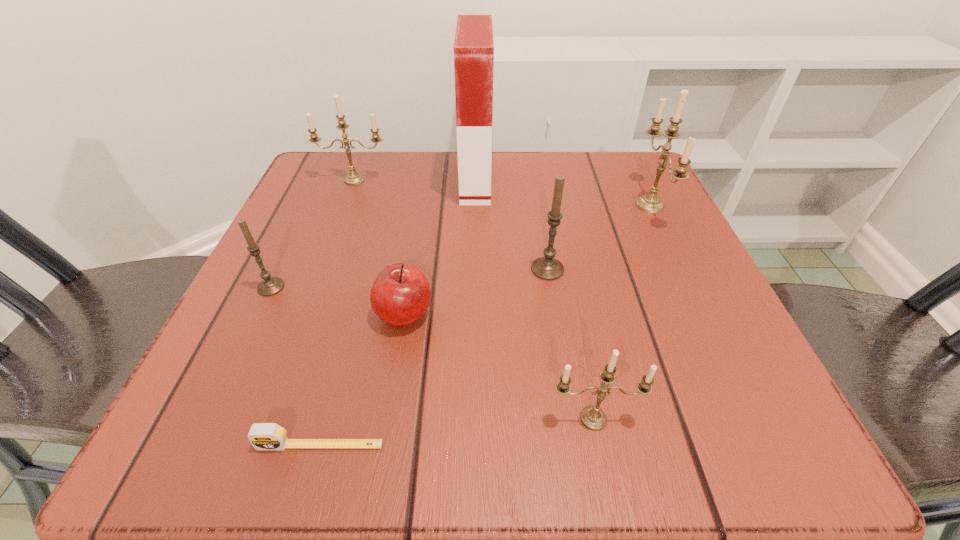
Where is `vacant space that's between the second smallest metallic candle and the nearest object`? This screenshot has width=960, height=540. vacant space that's between the second smallest metallic candle and the nearest object is located at coordinates (337, 312).

Image resolution: width=960 pixels, height=540 pixels. Identify the location of empty space that is in between the pink apple and the rightmost candle. (527, 260).

Image resolution: width=960 pixels, height=540 pixels. I want to click on vacant area between the rightmost metallic candle and the nearest candle, so click(x=621, y=312).

At what (x,y) coordinates should I click in order to perform the action: click on vacant space that is in between the pink apple and the second biggest metallic candle. Please return your answer as a coordinate pair (x, y). Looking at the image, I should click on (379, 247).

In order to click on unoccupied area between the smaller gray candle and the second biggest metallic candle in this screenshot , I will do `click(313, 233)`.

Identify which object is the fourth closest to the second metallic candle from left to right. Please provide its 2D coordinates. Your answer should be formatted as a tuple, i.e. [(x, y)], where the tuple contains the x and y coordinates of a point satisfying the conditions above.

[(651, 203)]

Select which object appears as the fourth closest to the nearest candle. Please provide its 2D coordinates. Your answer should be formatted as a tuple, i.e. [(x, y)], where the tuple contains the x and y coordinates of a point satisfying the conditions above.

[(651, 203)]

Choose which candle is the fourth nearest neighbor to the biggest metallic candle. Please provide its 2D coordinates. Your answer should be formatted as a tuple, i.e. [(x, y)], where the tuple contains the x and y coordinates of a point satisfying the conditions above.

[(269, 286)]

You are a GUI agent. You are given a task and a screenshot of the screen. Output one action in this format:
    pyautogui.click(x=<x>, y=<y>)
    Task: Click on the candle that is the fourth closest to the leftmost metallic candle
    
    Given the screenshot: What is the action you would take?
    pyautogui.click(x=592, y=417)

Choose which metallic candle is the second nearest neighbor to the second smallest metallic candle. Please provide its 2D coordinates. Your answer should be formatted as a tuple, i.e. [(x, y)], where the tuple contains the x and y coordinates of a point satisfying the conditions above.

[(592, 417)]